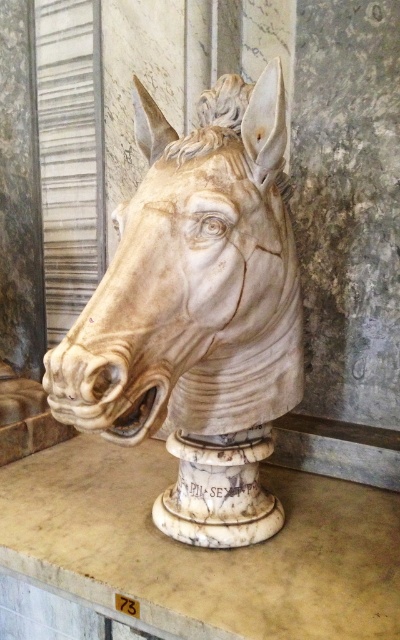
You are an art conservator examining the white marble horse head at center and the white marble pedestal at center. Which object has a greater width?

The white marble pedestal at center has a greater width than the white marble horse head at center.

You are an art conservator examining the sculpture. You need to determine if the white marble horse head at center can be safely placed on the white marble pedestal at center. What should you consider regarding their sizes?

The white marble horse head at center is larger in size than the white marble pedestal at center. Therefore, the horse head may not fit securely on the pedestal, and additional support or a larger base might be required.

Where is the white marble horse head at center located in the image?

The white marble horse head at center is located at point [198,314].